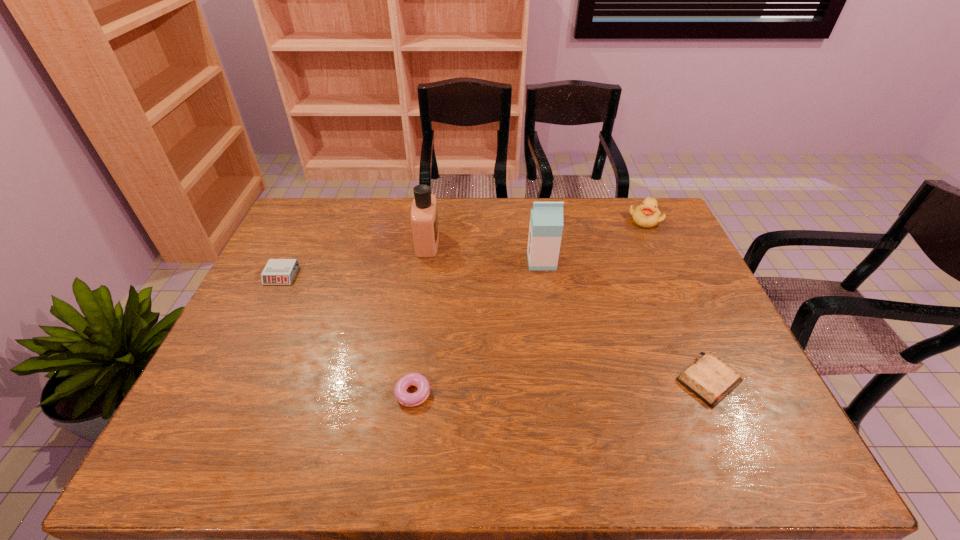
The image size is (960, 540). In the image, there is a desktop. Identify the location of vacant region at the near edge. (446, 444).

At what (x,y) coordinates should I click in order to perform the action: click on vacant point at the left edge. Please return your answer as a coordinate pair (x, y). The height and width of the screenshot is (540, 960). Looking at the image, I should click on (300, 256).

The image size is (960, 540). In order to click on blank space at the right edge of the desktop in this screenshot , I will do `click(721, 316)`.

In the image, there is a desktop. At what (x,y) coordinates should I click in order to perform the action: click on blank space at the far right corner. Please return your answer as a coordinate pair (x, y). This screenshot has height=540, width=960. Looking at the image, I should click on (665, 234).

The width and height of the screenshot is (960, 540). What are the coordinates of `blank space at the near right corner of the desktop` in the screenshot? It's located at (756, 436).

This screenshot has width=960, height=540. Find the location of `vacant space in between the alarm clock and the fourth shortest object`. vacant space in between the alarm clock and the fourth shortest object is located at coordinates (463, 247).

Locate an element on the screen. The image size is (960, 540). vacant space that is in between the doughnut and the perfume is located at coordinates pyautogui.click(x=421, y=318).

Identify the location of unoccupied position between the farthest object and the doughnut. Image resolution: width=960 pixels, height=540 pixels. (531, 307).

This screenshot has width=960, height=540. I want to click on free space between the farthest object and the diary, so click(677, 300).

Locate an element on the screen. free space between the alarm clock and the fourth object from left to right is located at coordinates (412, 268).